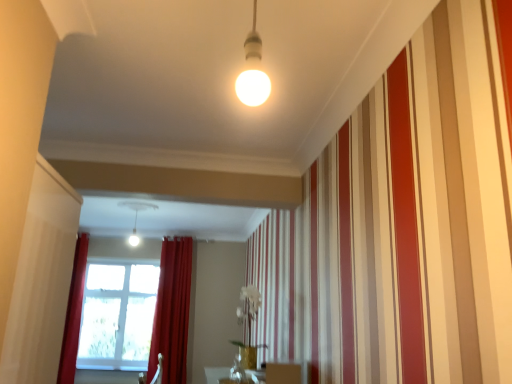
Question: From a real-world perspective, relative to velvet red curtain at center, arranged as the second curtain when viewed from the left, is transparent glass window screen at lower left vertically above or below?

Choices:
 (A) below
 (B) above

Answer: (A)

Question: From their relative heights in the image, would you say transparent glass window screen at lower left is taller or shorter than velvet red curtain at center, placed as the first curtain when sorted from right to left?

Choices:
 (A) tall
 (B) short

Answer: (B)

Question: Which object is positioned farthest from the velvet red curtain at center, arranged as the second curtain when viewed from the left?

Choices:
 (A) velvet red curtain at left, positioned as the second curtain in right-to-left order
 (B) matte white light fixture at center
 (C) matte gold vase at center
 (D) transparent glass window screen at lower left

Answer: (C)

Question: Estimate the real-world distances between objects in this image. Which object is closer to the velvet red curtain at center, arranged as the second curtain when viewed from the left?

Choices:
 (A) matte gold vase at center
 (B) transparent glass window screen at lower left
 (C) matte white light fixture at center
 (D) velvet red curtain at left, positioned as the second curtain in right-to-left order

Answer: (B)